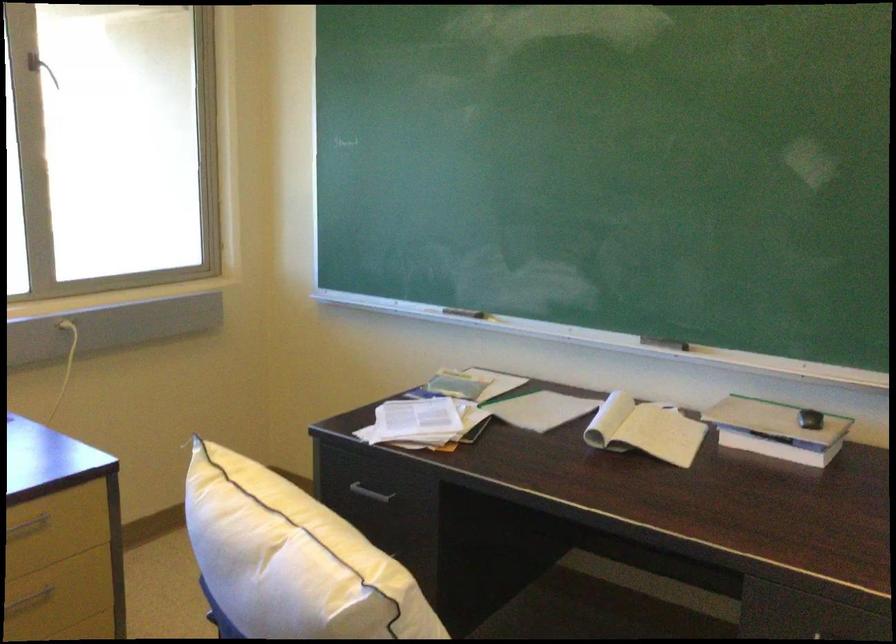
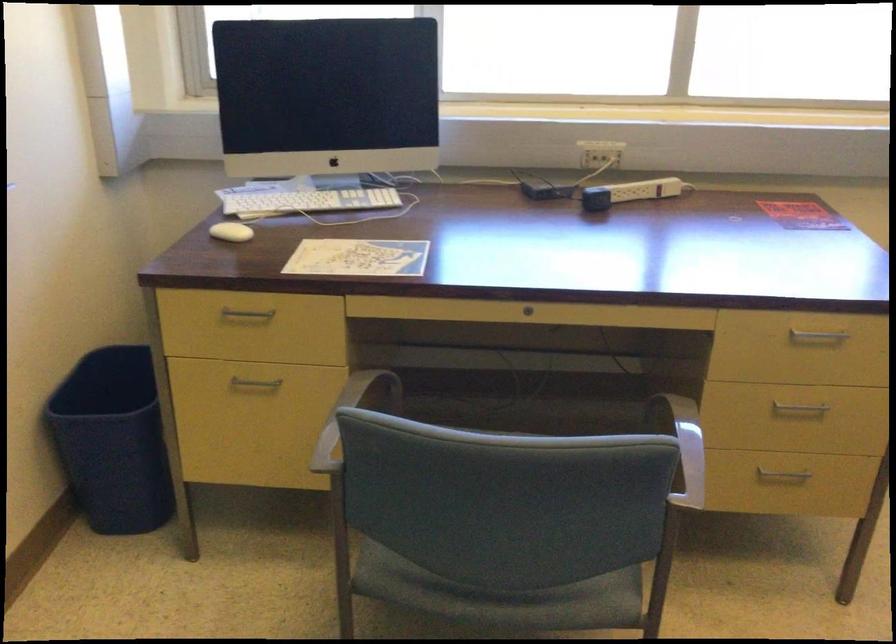
The images are taken continuously from a first-person perspective. In which direction is your viewpoint rotating?

The camera rotated toward left-down.